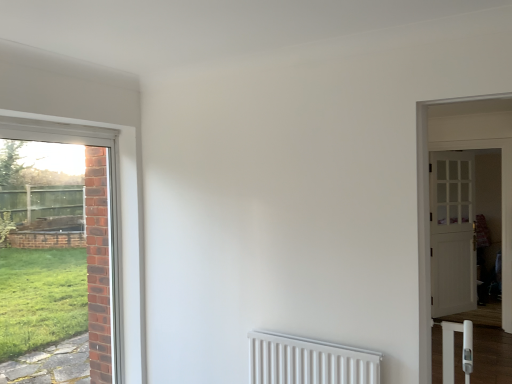
Question: Is matte glass door at left, the 1th door viewed from the front, to the right of white wooden door at right, the second door viewed from the right, from the viewer's perspective?

Choices:
 (A) yes
 (B) no

Answer: (B)

Question: Are matte glass door at left, which appears as the 3th door when viewed from the right, and white wooden door at right, the second door viewed from the right, making contact?

Choices:
 (A) yes
 (B) no

Answer: (B)

Question: Is matte glass door at left, which is counted as the 3th door, starting from the back, positioned beyond the bounds of white wooden door at right, the second door viewed from the right?

Choices:
 (A) yes
 (B) no

Answer: (A)

Question: Is matte glass door at left, which is counted as the 3th door, starting from the back, positioned behind white wooden door at right, the 2th door in the back-to-front sequence?

Choices:
 (A) yes
 (B) no

Answer: (B)

Question: From a real-world perspective, is matte glass door at left, which is counted as the 3th door, starting from the back, on white wooden door at right, the second door viewed from the right?

Choices:
 (A) no
 (B) yes

Answer: (B)

Question: From the image's perspective, relative to white plastic radiator at lower center, is white wooden door at right, the 1th door when ordered from back to front, above or below?

Choices:
 (A) above
 (B) below

Answer: (A)

Question: Based on their positions, is white wooden door at right, the 1th door when ordered from back to front, located to the left or right of white plastic radiator at lower center?

Choices:
 (A) left
 (B) right

Answer: (B)

Question: Considering the positions of white wooden door at right, the first door from the right, and white plastic radiator at lower center in the image, is white wooden door at right, the first door from the right, taller or shorter than white plastic radiator at lower center?

Choices:
 (A) tall
 (B) short

Answer: (A)

Question: Considering their positions, is white wooden door at right, arranged as the 3th door when viewed from the left, located in front of or behind white plastic radiator at lower center?

Choices:
 (A) front
 (B) behind

Answer: (B)

Question: In the image, is white plastic radiator at lower center positioned in front of or behind matte glass door at left, the 1th door viewed from the front?

Choices:
 (A) front
 (B) behind

Answer: (A)

Question: Considering the positions of white plastic radiator at lower center and matte glass door at left, which appears as the 3th door when viewed from the right, in the image, is white plastic radiator at lower center taller or shorter than matte glass door at left, which appears as the 3th door when viewed from the right,?

Choices:
 (A) short
 (B) tall

Answer: (A)

Question: Is white plastic radiator at lower center bigger or smaller than matte glass door at left, placed as the 1th door when sorted from left to right?

Choices:
 (A) big
 (B) small

Answer: (B)

Question: From the image's perspective, is white plastic radiator at lower center above or below matte glass door at left, which is counted as the 3th door, starting from the back?

Choices:
 (A) below
 (B) above

Answer: (A)

Question: Looking at their shapes, would you say matte glass door at left, which appears as the 3th door when viewed from the right, is wider or thinner than white wooden door at right, the third door from the front?

Choices:
 (A) thin
 (B) wide

Answer: (A)

Question: Considering the positions of point (120, 360) and point (441, 200), is point (120, 360) closer or farther from the camera than point (441, 200)?

Choices:
 (A) farther
 (B) closer

Answer: (B)